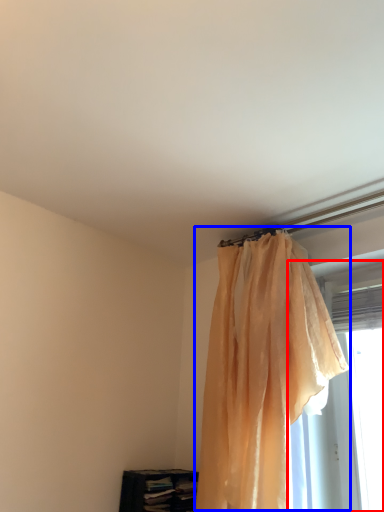
Question: Which object is closer to the camera taking this photo, window (highlighted by a red box) or curtain (highlighted by a blue box)?

Choices:
 (A) window
 (B) curtain

Answer: (B)